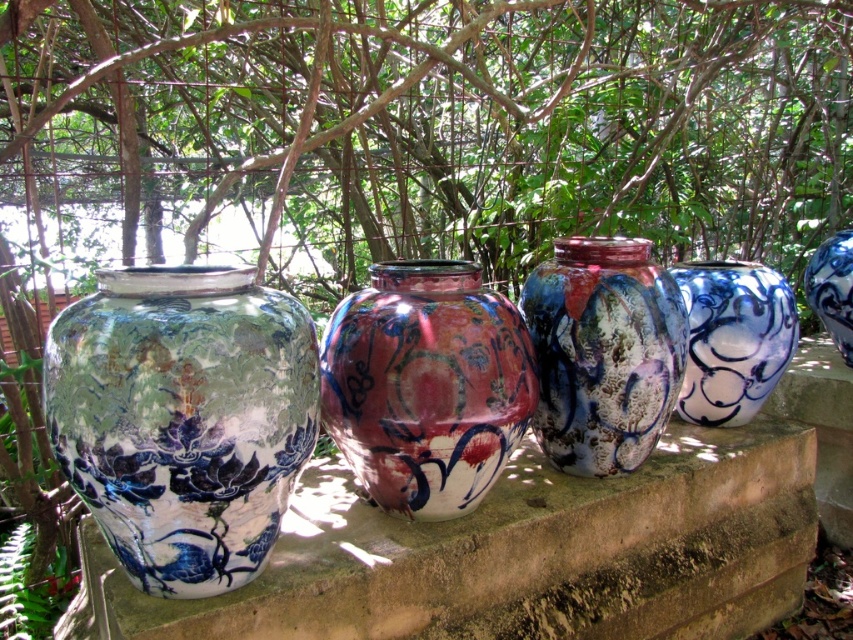
Question: From the image, what is the correct spatial relationship of blue and white glazed vase at left in relation to shiny ceramic vase at center?

Choices:
 (A) above
 (B) below

Answer: (B)

Question: Is blue and white glazed vase at left behind shiny ceramic vase at center?

Choices:
 (A) yes
 (B) no

Answer: (B)

Question: Which of the following is the closest to the observer?

Choices:
 (A) (743, 380)
 (B) (459, 512)
 (C) (833, 337)

Answer: (B)

Question: Which point appears closest to the camera in this image?

Choices:
 (A) (833, 298)
 (B) (447, 278)
 (C) (685, 298)
 (D) (288, 477)

Answer: (D)

Question: Is shiny ceramic vase at center closer to the viewer compared to blue glossy jar at upper right?

Choices:
 (A) no
 (B) yes

Answer: (B)

Question: Which point is farther from the camera taking this photo?

Choices:
 (A) (833, 250)
 (B) (764, 355)
 (C) (236, 308)
 (D) (502, 404)

Answer: (A)